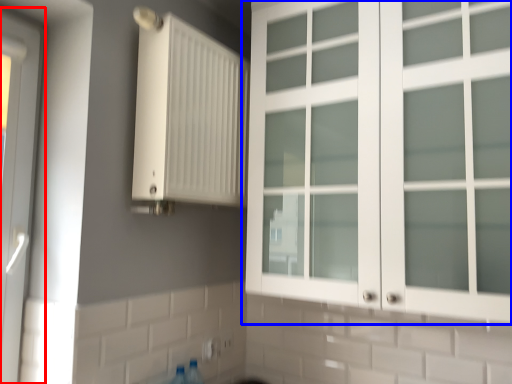
Question: Among these objects, which one is nearest to the camera, door (highlighted by a red box) or cupboard (highlighted by a blue box)?

Choices:
 (A) door
 (B) cupboard

Answer: (B)